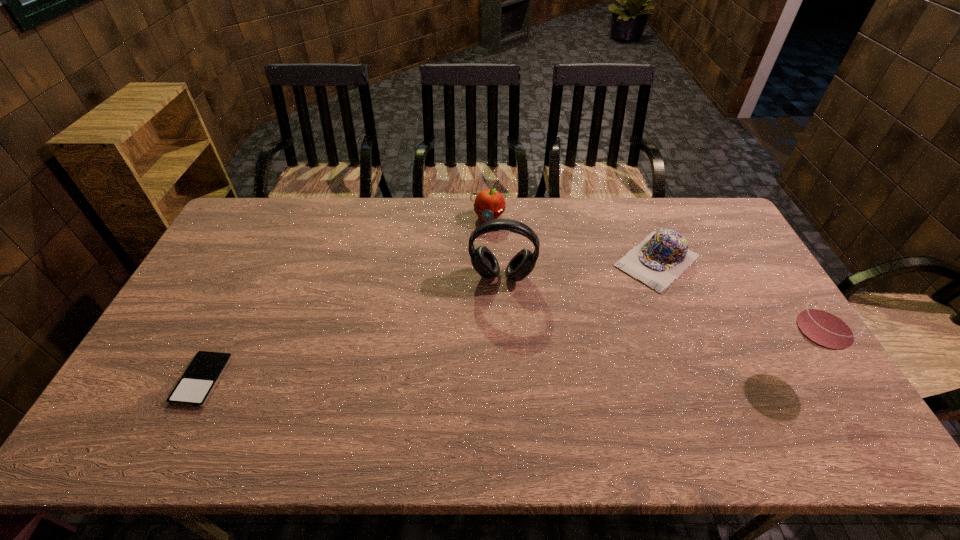
At what (x,y) coordinates should I click in order to perform the action: click on free space on the desktop that is between the leftmost object and the wineglass and is positioned on the earcups of the headset. Please return your answer as a coordinate pair (x, y). Looking at the image, I should click on (492, 374).

Find the location of `free spot on the desktop that is between the iPod and the rightmost object and is positioned on the front, side, and top of the cap`. free spot on the desktop that is between the iPod and the rightmost object and is positioned on the front, side, and top of the cap is located at coordinates (533, 373).

Locate an element on the screen. The image size is (960, 540). vacant space on the desktop that is between the shortest object and the wineglass and is positioned on the surface of the third tallest object is located at coordinates (450, 375).